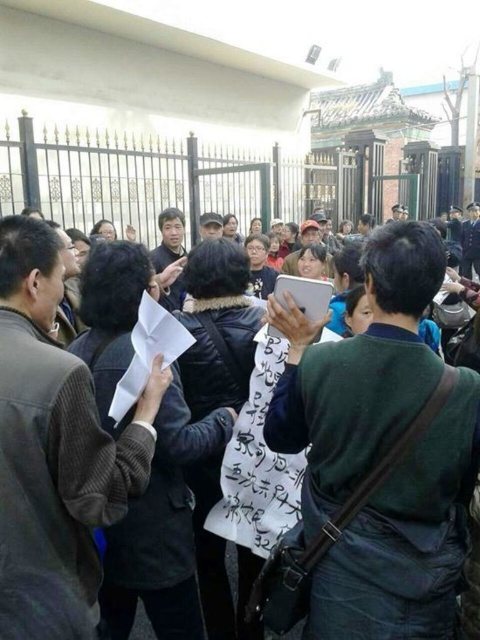
Is the position of green fabric shirt at center more distant than that of white paper at center?

Yes, it is behind white paper at center.

Which of these two, green fabric shirt at center or white paper at center, stands shorter?

white paper at center is shorter.

Between point (450, 538) and point (34, 353), which one is positioned behind?

The point (450, 538) is behind.

This screenshot has width=480, height=640. Identify the location of green fabric shirt at center. 358,371.